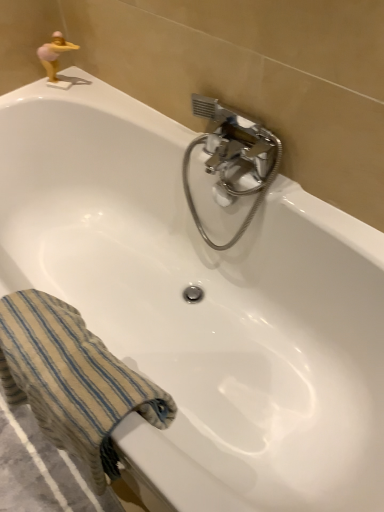
Question: Considering the relative positions of gold plastic figurine at upper left and chrome metallic faucet at upper center in the image provided, is gold plastic figurine at upper left to the right of chrome metallic faucet at upper center from the viewer's perspective?

Choices:
 (A) no
 (B) yes

Answer: (A)

Question: Does gold plastic figurine at upper left turn towards chrome metallic faucet at upper center?

Choices:
 (A) no
 (B) yes

Answer: (A)

Question: Considering the relative sizes of gold plastic figurine at upper left and chrome metallic faucet at upper center in the image provided, is gold plastic figurine at upper left smaller than chrome metallic faucet at upper center?

Choices:
 (A) yes
 (B) no

Answer: (A)

Question: From a real-world perspective, is gold plastic figurine at upper left located beneath chrome metallic faucet at upper center?

Choices:
 (A) yes
 (B) no

Answer: (B)

Question: Does gold plastic figurine at upper left come in front of chrome metallic faucet at upper center?

Choices:
 (A) yes
 (B) no

Answer: (B)

Question: Does gold plastic figurine at upper left have a greater height compared to chrome metallic faucet at upper center?

Choices:
 (A) no
 (B) yes

Answer: (A)

Question: From a real-world perspective, is beige striped towel at lower left physically above chrome metallic faucet at upper center?

Choices:
 (A) no
 (B) yes

Answer: (A)

Question: Considering the relative sizes of beige striped towel at lower left and chrome metallic faucet at upper center in the image provided, is beige striped towel at lower left shorter than chrome metallic faucet at upper center?

Choices:
 (A) no
 (B) yes

Answer: (B)

Question: Can you confirm if beige striped towel at lower left is wider than chrome metallic faucet at upper center?

Choices:
 (A) no
 (B) yes

Answer: (B)

Question: Are beige striped towel at lower left and chrome metallic faucet at upper center located far from each other?

Choices:
 (A) no
 (B) yes

Answer: (A)

Question: Can you confirm if beige striped towel at lower left is positioned to the right of chrome metallic faucet at upper center?

Choices:
 (A) no
 (B) yes

Answer: (A)

Question: From the image's perspective, is beige striped towel at lower left located beneath chrome metallic faucet at upper center?

Choices:
 (A) yes
 (B) no

Answer: (A)

Question: From the image's perspective, is chrome metallic faucet at upper center on top of beige striped towel at lower left?

Choices:
 (A) yes
 (B) no

Answer: (A)